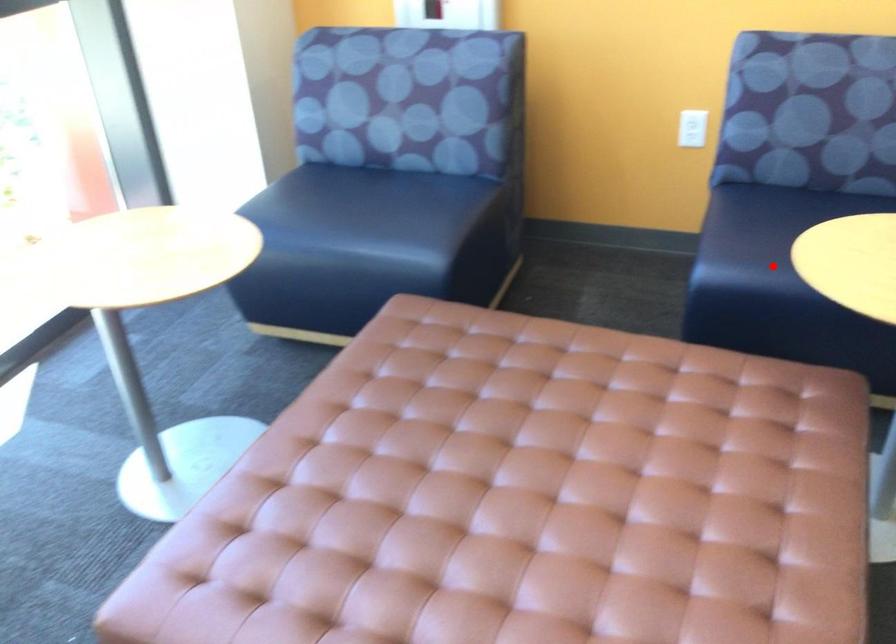
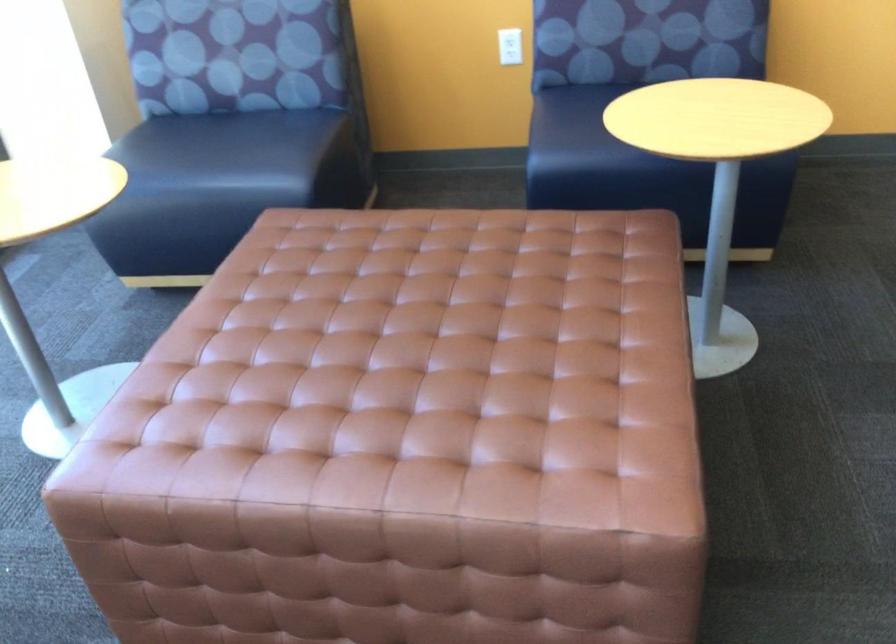
Question: I am providing you with two images of the same scene from different viewpoints. Image1 has a red point marked. In image2, the corresponding 3D location appears at what relative position? Reply with the corresponding letter.

Choices:
 (A) Closer
 (B) Farther

Answer: (B)